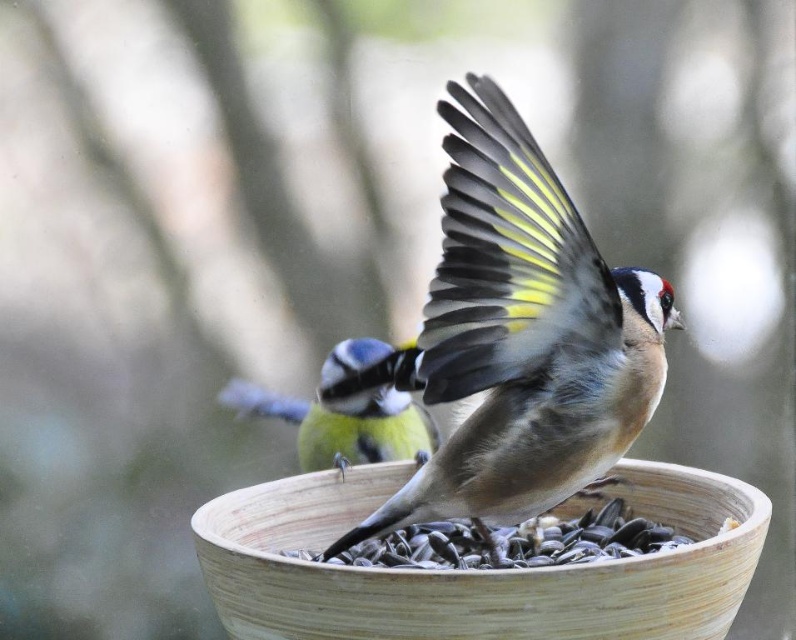
Is point (404, 634) in front of point (314, 406)?

Yes, point (404, 634) is closer to viewer.

Who is more forward, (246, 634) or (387, 422)?

Positioned in front is point (246, 634).

Find the location of a particular element. Image resolution: width=796 pixels, height=640 pixels. natural wood bowl at center is located at coordinates point(475,570).

Which is more to the right, brown matte seeds at center or blue-green feathered bird at center?

brown matte seeds at center

Which is in front, point (603, 552) or point (359, 445)?

Point (603, 552)

Find the location of `brown matte seeds at center`. brown matte seeds at center is located at coordinates (512, 541).

Can you confirm if brown speckled feathers at center is positioned to the left of blue-green feathered bird at center?

No, brown speckled feathers at center is not to the left of blue-green feathered bird at center.

Does brown speckled feathers at center have a greater width compared to blue-green feathered bird at center?

Correct, the width of brown speckled feathers at center exceeds that of blue-green feathered bird at center.

In order to click on brown speckled feathers at center in this screenshot , I will do `click(523, 337)`.